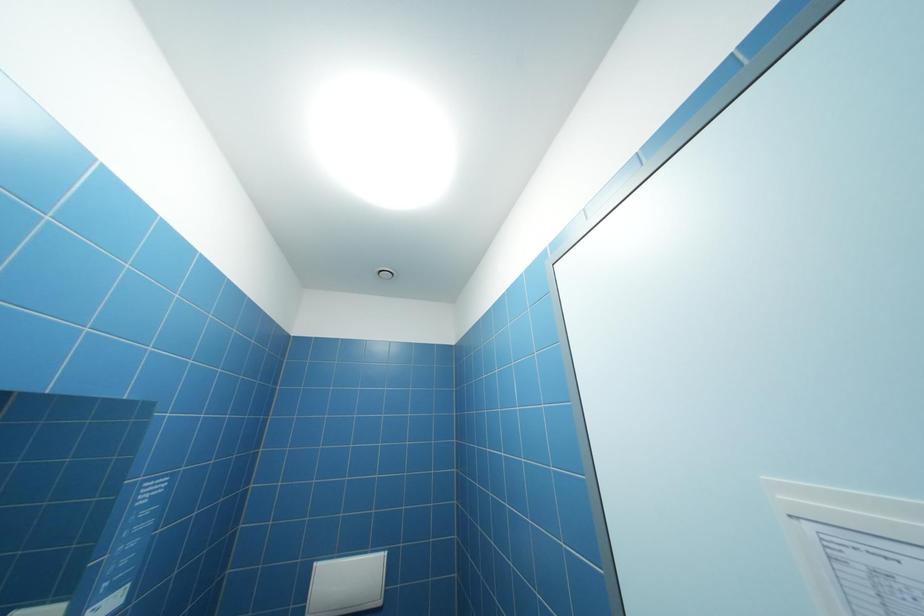
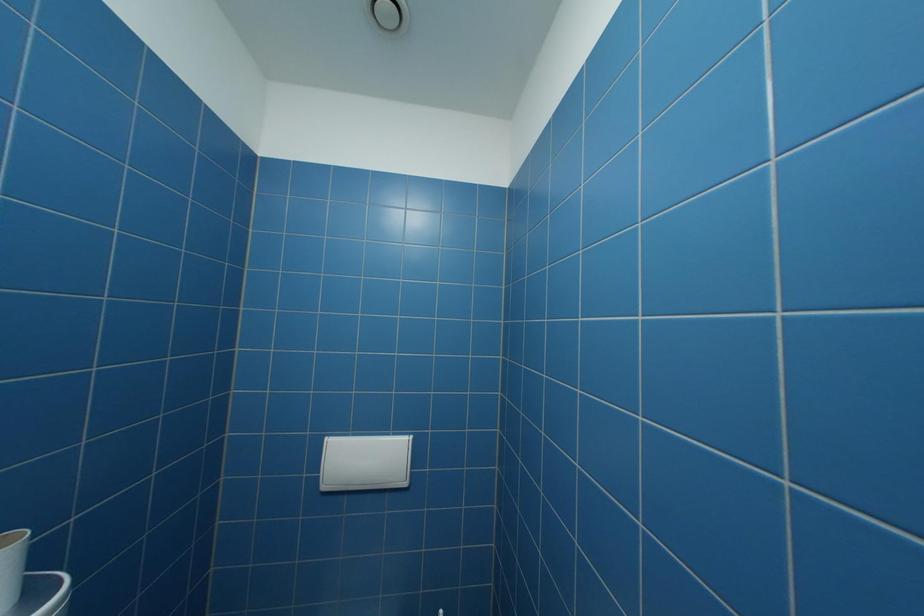
Question: The first image is from the beginning of the video and the second image is from the end. How did the camera likely rotate when shooting the video?

Choices:
 (A) Left
 (B) Right
 (C) Up
 (D) Down

Answer: (D)